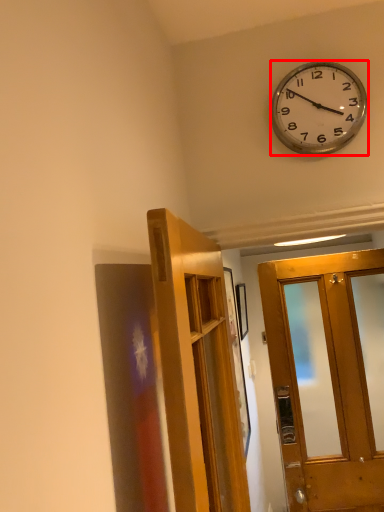
Question: From the image's perspective, what is the correct spatial relationship of wall clock (annotated by the red box) in relation to door?

Choices:
 (A) above
 (B) below

Answer: (A)